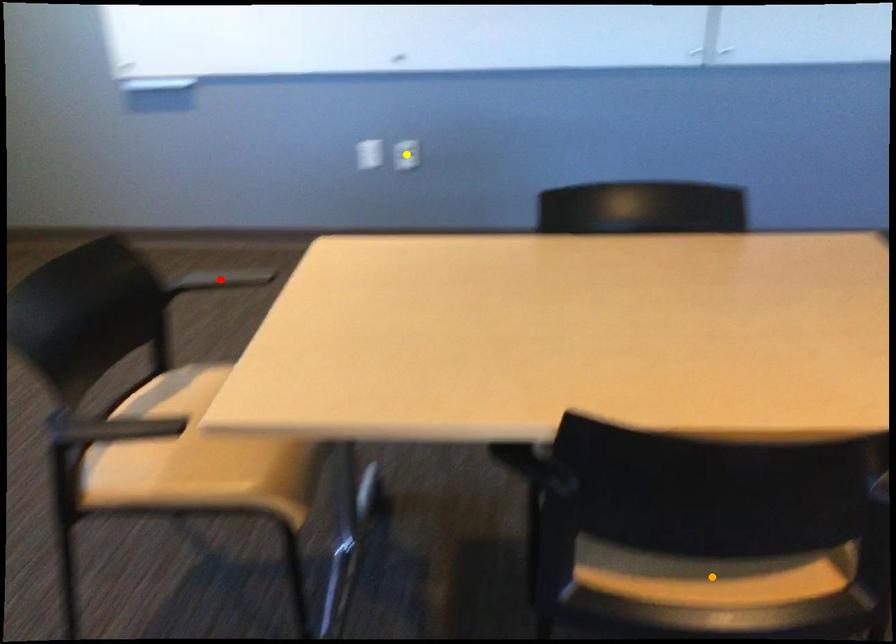
Order these from farthest to nearest:
yellow point
red point
orange point

red point → yellow point → orange point